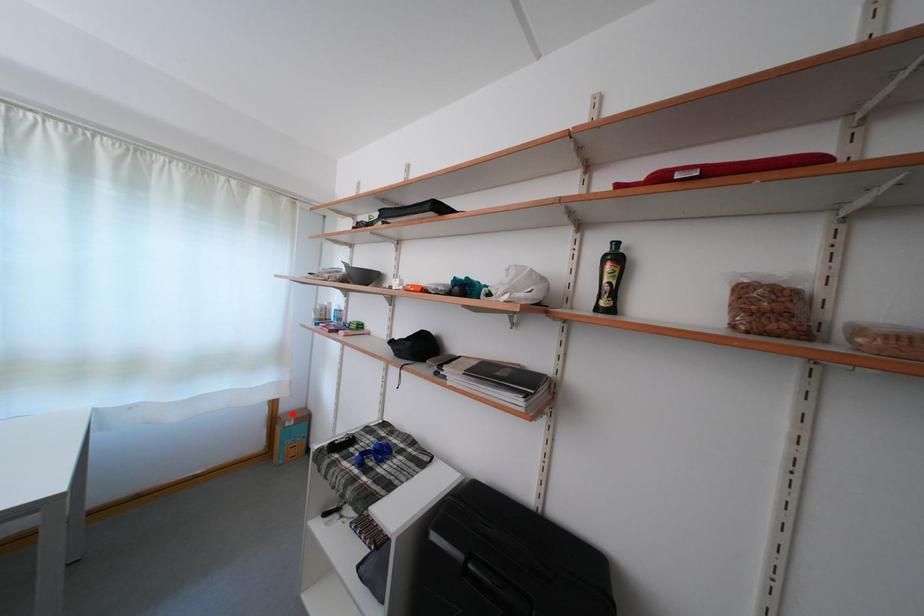
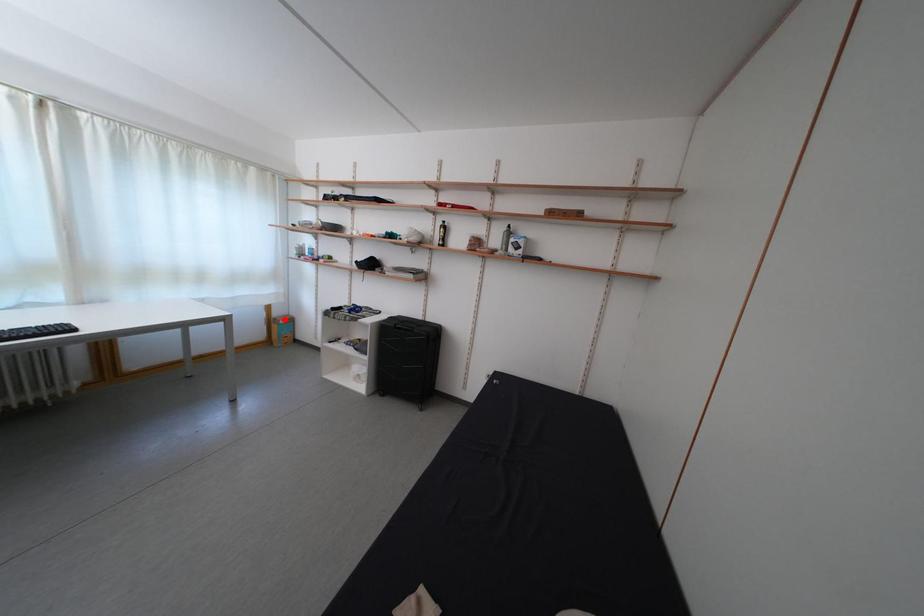
I am providing you with two images of the same scene from different viewpoints. A red point is marked on the first image and another point is marked on the second image. Do the highlighted points in image1 and image2 indicate the same real-world spot?

Yes